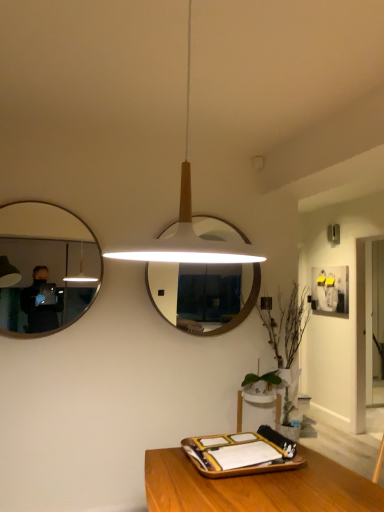
Question: Considering the relative sizes of matte black mirror at left, which is the 1th mirror from left to right, and green leafy plant at lower right in the image provided, is matte black mirror at left, which is the 1th mirror from left to right, wider than green leafy plant at lower right?

Choices:
 (A) no
 (B) yes

Answer: (A)

Question: Can green leafy plant at lower right be found inside matte black mirror at left, which is the 1th mirror from left to right?

Choices:
 (A) no
 (B) yes

Answer: (A)

Question: Is matte black mirror at left, which is the 1th mirror from left to right, oriented away from green leafy plant at lower right?

Choices:
 (A) no
 (B) yes

Answer: (A)

Question: Does matte black mirror at left, acting as the first mirror starting from the front, have a lesser width compared to green leafy plant at lower right?

Choices:
 (A) yes
 (B) no

Answer: (A)

Question: Are matte black mirror at left, which is the 1th mirror from left to right, and green leafy plant at lower right beside each other?

Choices:
 (A) yes
 (B) no

Answer: (B)

Question: Is matte white picture frame at upper right spatially inside green leafy plant at lower right, or outside of it?

Choices:
 (A) inside
 (B) outside

Answer: (B)

Question: Would you say matte white picture frame at upper right is to the left or to the right of green leafy plant at lower right in the picture?

Choices:
 (A) right
 (B) left

Answer: (A)

Question: In terms of width, does matte white picture frame at upper right look wider or thinner when compared to green leafy plant at lower right?

Choices:
 (A) thin
 (B) wide

Answer: (A)

Question: Relative to green leafy plant at lower right, is matte white picture frame at upper right in front or behind?

Choices:
 (A) front
 (B) behind

Answer: (B)

Question: Is wooden tray at lower center bigger or smaller than white wooden mirror at center, marked as the 2th mirror in a left-to-right arrangement?

Choices:
 (A) small
 (B) big

Answer: (A)

Question: From the image's perspective, is wooden tray at lower center positioned above or below white wooden mirror at center, which is the first mirror in right-to-left order?

Choices:
 (A) below
 (B) above

Answer: (A)

Question: Is wooden tray at lower center taller or shorter than white wooden mirror at center, which is the 1th mirror from back to front?

Choices:
 (A) short
 (B) tall

Answer: (A)

Question: Would you say wooden tray at lower center is inside or outside white wooden mirror at center, marked as the 2th mirror in a left-to-right arrangement?

Choices:
 (A) outside
 (B) inside

Answer: (A)

Question: Considering the positions of white matte pendant light at center and green leafy plant at lower right in the image, is white matte pendant light at center bigger or smaller than green leafy plant at lower right?

Choices:
 (A) big
 (B) small

Answer: (A)

Question: Based on their positions, is white matte pendant light at center located to the left or right of green leafy plant at lower right?

Choices:
 (A) right
 (B) left

Answer: (B)